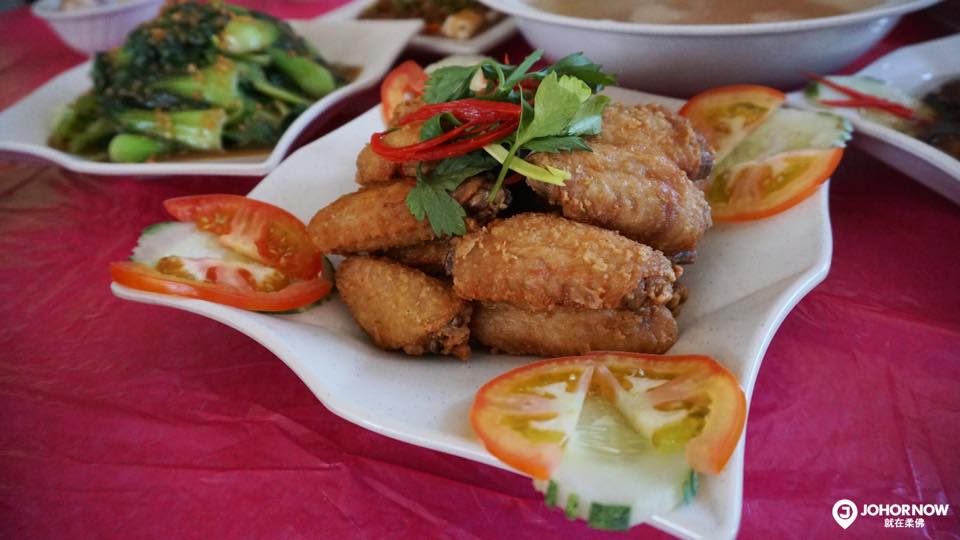
Find the location of a particular element. towel is located at coordinates (847, 454).